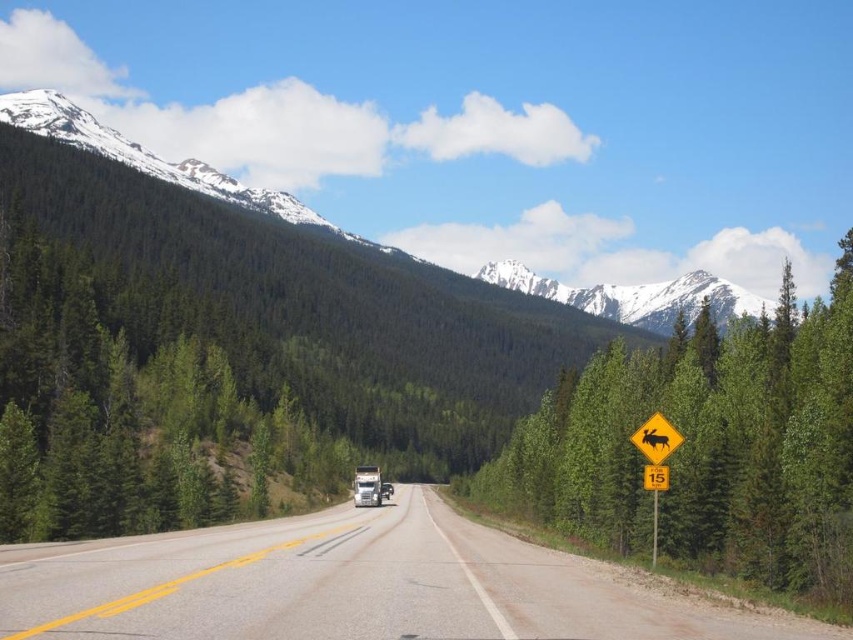
Does point (757, 467) come behind point (651, 488)?

Yes, point (757, 467) is farther from viewer.

Is green matte tree at center thinner than yellow plastic sign at center right?

In fact, green matte tree at center might be wider than yellow plastic sign at center right.

This screenshot has height=640, width=853. What are the coordinates of `green matte tree at center` in the screenshot? It's located at pos(704,448).

Based on the photo, measure the distance between snowy granite mountain at upper center and brushed metal trailer truck at center.

A distance of 390.18 meters exists between snowy granite mountain at upper center and brushed metal trailer truck at center.

Can you confirm if snowy granite mountain at upper center is positioned above brushed metal trailer truck at center?

Yes, snowy granite mountain at upper center is above brushed metal trailer truck at center.

Between point (733, 316) and point (375, 477), which one is positioned behind?

Positioned behind is point (733, 316).

Find the location of a particular element. This screenshot has width=853, height=640. snowy granite mountain at upper center is located at coordinates (637, 296).

Does point (753, 316) come farther from viewer compared to point (657, 481)?

Yes, it is.

Is snowy granite mountain at upper center above yellow plastic sign at center right?

Yes.

Between point (592, 288) and point (660, 472), which one is positioned in front?

Point (660, 472) is in front.

Find the location of `snowy granite mountain at upper center`. snowy granite mountain at upper center is located at coordinates (637, 296).